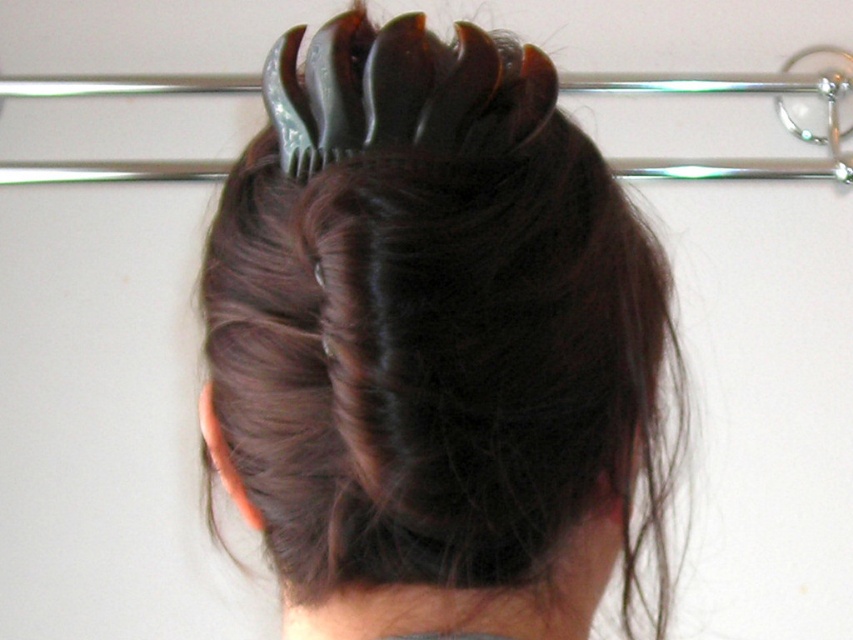
Question: Is dark brown glossy hair clip at center further to the viewer compared to black plastic hair clip at upper center?

Choices:
 (A) yes
 (B) no

Answer: (B)

Question: Does dark brown glossy hair clip at center appear under black plastic hair clip at upper center?

Choices:
 (A) no
 (B) yes

Answer: (B)

Question: Does dark brown glossy hair clip at center appear on the left side of black plastic hair clip at upper center?

Choices:
 (A) yes
 (B) no

Answer: (A)

Question: Which point is farther from the camera taking this photo?

Choices:
 (A) (732, 84)
 (B) (473, 262)

Answer: (A)